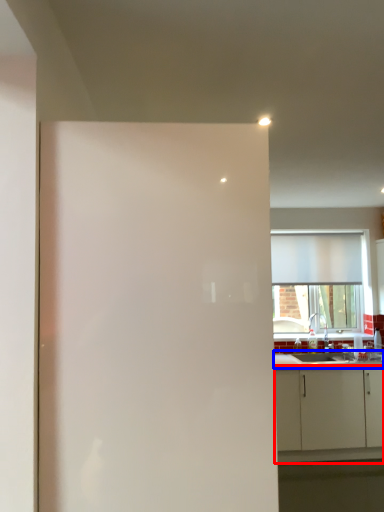
Question: Which object appears farthest to the camera in this image, cabinetry (highlighted by a red box) or countertop (highlighted by a blue box)?

Choices:
 (A) cabinetry
 (B) countertop

Answer: (B)